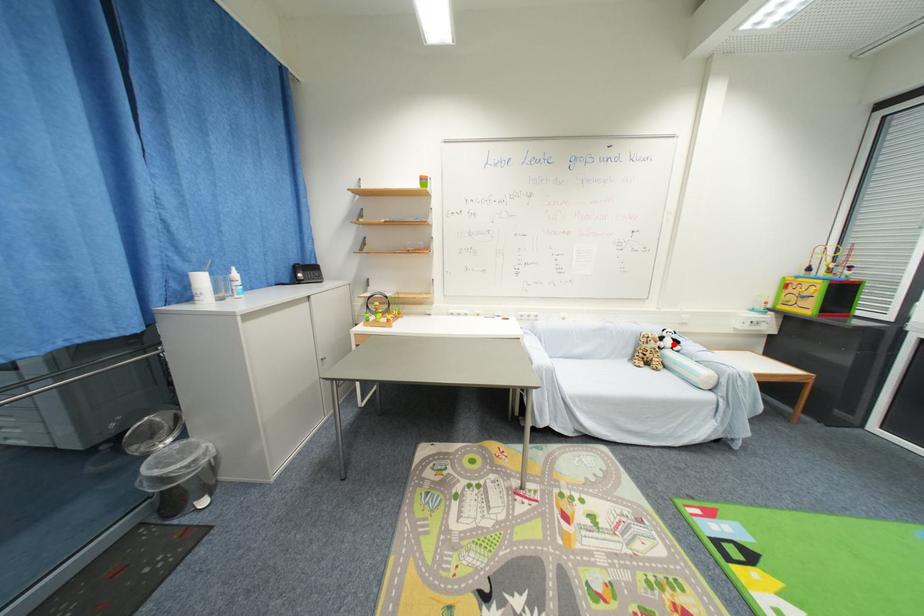
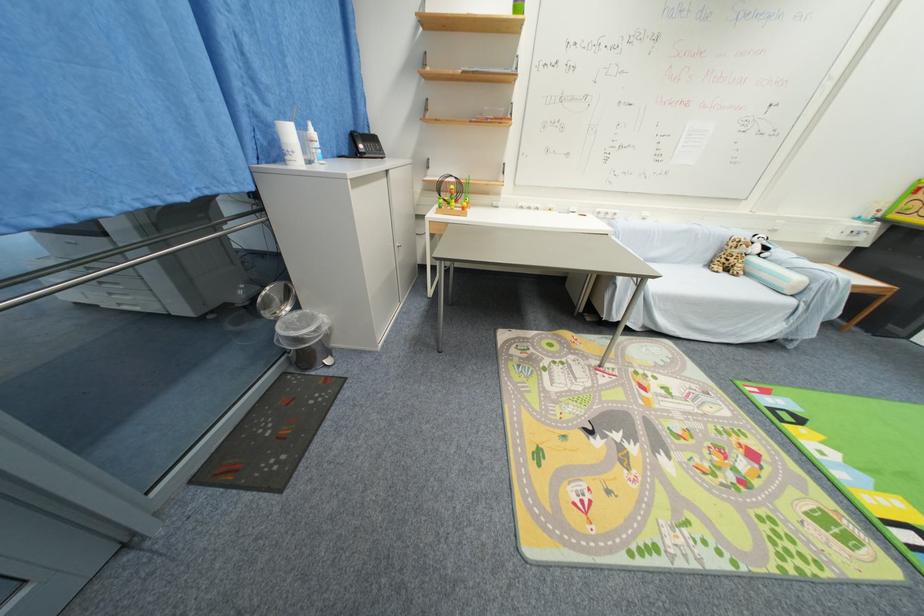
In the second image, find the point that corresponds to the highlighted location in the first image.

(761, 251)